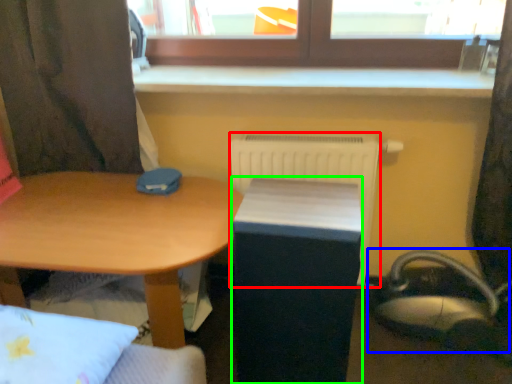
Question: Estimate the real-world distances between objects in this image. Which object is closer to radiator (highlighted by a red box), swivel chair (highlighted by a blue box) or changing table (highlighted by a green box)?

Choices:
 (A) swivel chair
 (B) changing table

Answer: (B)